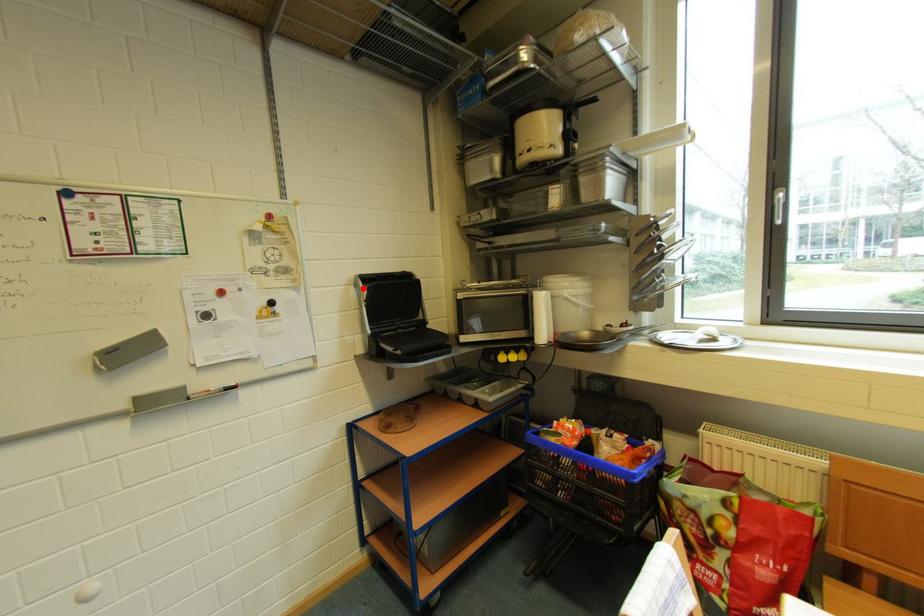
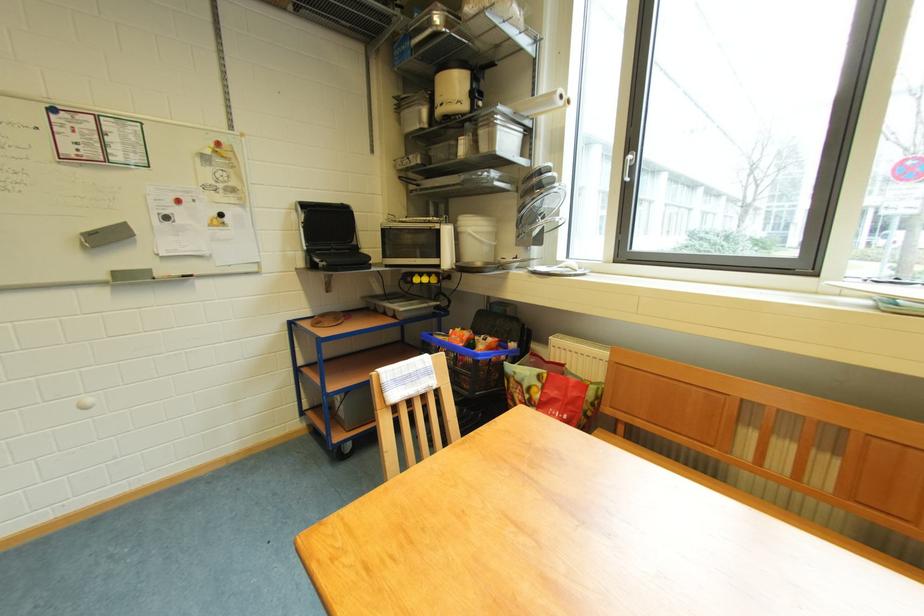
Find the pixel in the second image that matches the highlighted location in the first image.

(305, 214)